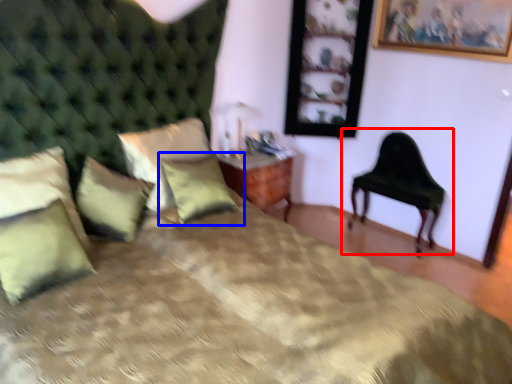
Question: Which point is closer to the camera, chair (highlighted by a red box) or pillow (highlighted by a blue box)?

Choices:
 (A) chair
 (B) pillow

Answer: (B)